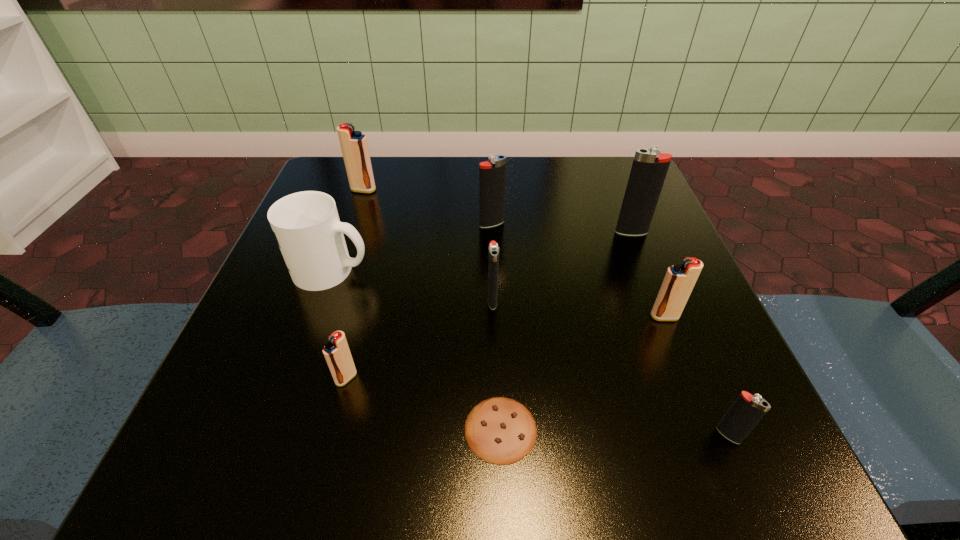
Locate an element on the screen. free space located 0.340m on the handle side of the white mug is located at coordinates (564, 270).

Find the location of a particular element. This screenshot has width=960, height=540. free space located 0.290m on the left of the fifth farthest object is located at coordinates pos(311,301).

You are a GUI agent. You are given a task and a screenshot of the screen. Output one action in this format:
    pyautogui.click(x=<x>, y=<y>)
    Task: Click on the free space located 0.210m on the left of the fourth nearest object
    The height and width of the screenshot is (540, 960).
    Given the screenshot: What is the action you would take?
    pyautogui.click(x=518, y=316)

You are a GUI agent. You are given a task and a screenshot of the screen. Output one action in this format:
    pyautogui.click(x=<x>, y=<y>)
    Task: Click on the vacant space located 0.270m on the back of the second nearest igniter
    This screenshot has height=540, width=960.
    Given the screenshot: What is the action you would take?
    379,247

At what (x,y) coordinates should I click in order to perform the action: click on free space located 0.290m on the back of the nearest black igniter. Please return your answer as a coordinate pair (x, y). Looking at the image, I should click on (659, 272).

Image resolution: width=960 pixels, height=540 pixels. I want to click on vacant space located 0.260m on the left of the cookie, so click(261, 429).

Locate an element on the screen. This screenshot has width=960, height=540. object present at the far edge is located at coordinates (354, 146).

You are a GUI agent. You are given a task and a screenshot of the screen. Output one action in this format:
    pyautogui.click(x=<x>, y=<y>)
    Task: Click on the igniter at the near edge
    This screenshot has height=540, width=960.
    Given the screenshot: What is the action you would take?
    pyautogui.click(x=747, y=410)

This screenshot has height=540, width=960. Identify the location of cookie that is at the near edge. (499, 430).

Find the location of a particular element. This screenshot has height=540, width=960. igniter located in the left edge section of the desktop is located at coordinates (354, 146).